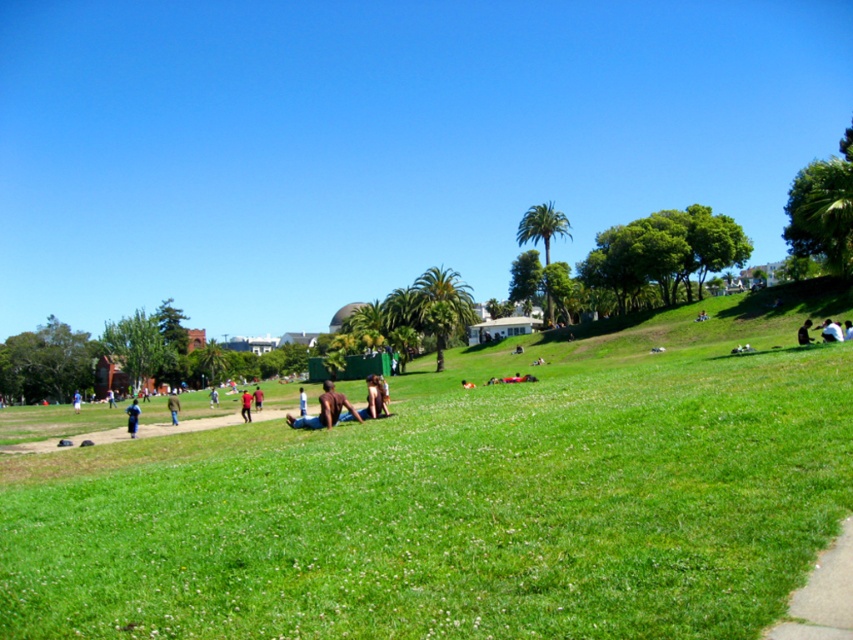
Question: Which point appears farthest from the camera in this image?

Choices:
 (A) (300, 390)
 (B) (73, 401)
 (C) (834, 330)

Answer: (B)

Question: Which point is farther to the camera?

Choices:
 (A) blurred skin person at center
 (B) red shirt at center
 (C) smooth tan skin at center
 (D) blurred red shirt at center

Answer: (D)

Question: Does green grassy field at center appear on the right side of green fabric jacket at center?

Choices:
 (A) yes
 (B) no

Answer: (A)

Question: Among these points, which one is nearest to the camera?

Choices:
 (A) (177, 420)
 (B) (838, 330)
 (C) (107, 401)

Answer: (B)

Question: Is smooth tan skin at center further to the viewer compared to red shirt at center?

Choices:
 (A) no
 (B) yes

Answer: (A)

Question: Where is blue fabric shirt at lower left located in relation to dark blue jeans at lower right in the image?

Choices:
 (A) left
 (B) right

Answer: (A)